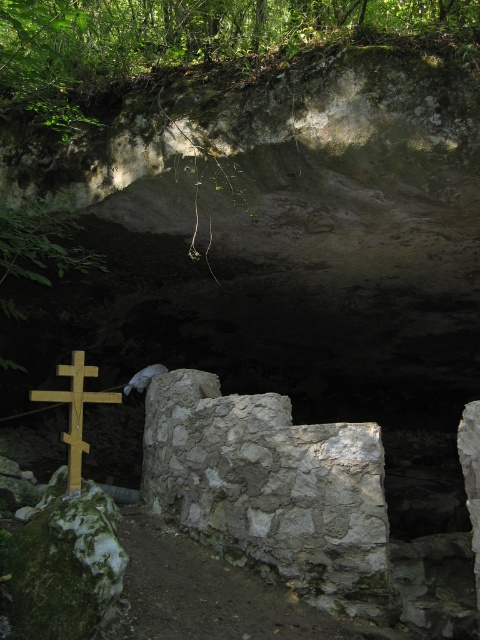
Question: Is gray stone wall at center to the right of wooden cross at left from the viewer's perspective?

Choices:
 (A) no
 (B) yes

Answer: (B)

Question: Is gray stone wall at center above wooden cross at left?

Choices:
 (A) yes
 (B) no

Answer: (B)

Question: Observing the image, what is the correct spatial positioning of gray stone wall at center in reference to wooden cross at left?

Choices:
 (A) left
 (B) right

Answer: (B)

Question: Among these objects, which one is farthest from the camera?

Choices:
 (A) wooden cross at left
 (B) gray stone wall at center

Answer: (B)

Question: Among these objects, which one is farthest from the camera?

Choices:
 (A) gray stone wall at center
 (B) wooden cross at left

Answer: (A)